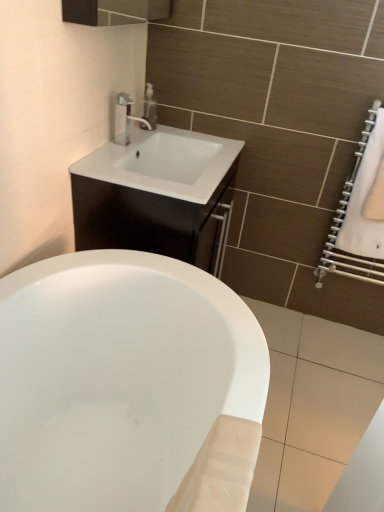
What are the coordinates of `matte silver soap dispenser at upper center` in the screenshot? It's located at (149, 109).

This screenshot has width=384, height=512. Describe the element at coordinates (149, 109) in the screenshot. I see `matte silver soap dispenser at upper center` at that location.

In order to face white fabric towel at right, should I rotate leftwards or rightwards?

Turn right by 23.436 degrees to look at white fabric towel at right.

Locate an element on the screen. white glossy cabinet at upper center is located at coordinates (156, 192).

Does matte silver soap dispenser at upper center have a lesser width compared to white glossy cabinet at upper center?

Yes.

From a real-world perspective, is matte silver soap dispenser at upper center below white glossy cabinet at upper center?

No, from a real-world perspective, matte silver soap dispenser at upper center is not under white glossy cabinet at upper center.

Who is shorter, matte silver soap dispenser at upper center or white glossy cabinet at upper center?

With less height is matte silver soap dispenser at upper center.

From the image's perspective, between matte silver soap dispenser at upper center and white glossy cabinet at upper center, which one is located above?

From the image's view, matte silver soap dispenser at upper center is above.

Looking at this image, can you confirm if white glossy cabinet at upper center is bigger than satin nickel faucet at upper center?

Correct, white glossy cabinet at upper center is larger in size than satin nickel faucet at upper center.

Is white glossy cabinet at upper center spatially inside satin nickel faucet at upper center, or outside of it?

white glossy cabinet at upper center is not enclosed by satin nickel faucet at upper center.

Can you tell me how much white glossy cabinet at upper center and satin nickel faucet at upper center differ in facing direction?

They differ by 1.47 degrees in their facing directions.

Would you say white glossy cabinet at upper center is to the left or to the right of satin nickel faucet at upper center in the picture?

white glossy cabinet at upper center is positioned on satin nickel faucet at upper center's right side.

Which is less distant, (x=143, y=126) or (x=122, y=101)?

Point (x=143, y=126).

Can you tell me how much matte silver soap dispenser at upper center and satin nickel faucet at upper center differ in facing direction?

The angular difference between matte silver soap dispenser at upper center and satin nickel faucet at upper center is 0.00116 degrees.

Which object is closer to the camera taking this photo, matte silver soap dispenser at upper center or satin nickel faucet at upper center?

satin nickel faucet at upper center.

Between matte silver soap dispenser at upper center and satin nickel faucet at upper center, which one has less height?

Standing shorter between the two is matte silver soap dispenser at upper center.

Based on the photo, from the image's perspective, relative to matte silver soap dispenser at upper center, is white glossy cabinet at upper center above or below?

From the image's perspective, white glossy cabinet at upper center appears below matte silver soap dispenser at upper center.

Is white glossy cabinet at upper center not close to matte silver soap dispenser at upper center?

No, there isn't a large distance between white glossy cabinet at upper center and matte silver soap dispenser at upper center.

From the picture: Based on their positions, is white glossy cabinet at upper center located to the left or right of matte silver soap dispenser at upper center?

From the image, it's evident that white glossy cabinet at upper center is to the right of matte silver soap dispenser at upper center.

Is matte silver soap dispenser at upper center bigger than white fabric towel at right?

No.

Where is `bath towel lying on the right of matte silver soap dispenser at upper center`? bath towel lying on the right of matte silver soap dispenser at upper center is located at coordinates (364, 202).

From a real-world perspective, is matte silver soap dispenser at upper center physically located above or below white fabric towel at right?

In terms of real-world spatial position, matte silver soap dispenser at upper center is above white fabric towel at right.

Is matte silver soap dispenser at upper center wider or thinner than white fabric towel at right?

Considering their sizes, matte silver soap dispenser at upper center looks broader than white fabric towel at right.

Considering the sizes of white fabric towel at right and matte silver soap dispenser at upper center in the image, is white fabric towel at right taller or shorter than matte silver soap dispenser at upper center?

In the image, white fabric towel at right appears to be taller than matte silver soap dispenser at upper center.

From the image's perspective, relative to matte silver soap dispenser at upper center, is white fabric towel at right above or below?

white fabric towel at right is below matte silver soap dispenser at upper center.

Is white fabric towel at right completely or partially outside of matte silver soap dispenser at upper center?

white fabric towel at right lies outside matte silver soap dispenser at upper center's area.

Which is further, [211,241] or [378,231]?

The point [378,231] is farther.

From the image's perspective, is white glossy cabinet at upper center on top of white fabric towel at right?

Incorrect, from the image's perspective, white glossy cabinet at upper center is lower than white fabric towel at right.

Considering the sizes of white glossy cabinet at upper center and white fabric towel at right in the image, is white glossy cabinet at upper center bigger or smaller than white fabric towel at right?

white glossy cabinet at upper center is bigger than white fabric towel at right.

Locate an element on the screen. The height and width of the screenshot is (512, 384). bath towel that is behind the white glossy cabinet at upper center is located at coordinates (364, 202).

Identify the location of soap dispenser above the white glossy cabinet at upper center (from the image's perspective). Image resolution: width=384 pixels, height=512 pixels. (149, 109).

This screenshot has width=384, height=512. I want to click on bathroom cabinet located underneath the satin nickel faucet at upper center (from a real-world perspective), so (x=156, y=192).

Based on their spatial positions, is white fabric towel at right or white glossy cabinet at upper center further from matte silver soap dispenser at upper center?

white fabric towel at right.

Considering their positions, is matte silver soap dispenser at upper center positioned closer to white fabric towel at right than white glossy cabinet at upper center?

white glossy cabinet at upper center.

Based on their spatial positions, is white fabric towel at right or matte silver soap dispenser at upper center closer to satin nickel faucet at upper center?

matte silver soap dispenser at upper center lies closer to satin nickel faucet at upper center than the other object.

Consider the image. Looking at the image, which one is located closer to matte silver soap dispenser at upper center, satin nickel faucet at upper center or white glossy cabinet at upper center?

satin nickel faucet at upper center is positioned closer to the anchor matte silver soap dispenser at upper center.

Considering their positions, is white glossy cabinet at upper center positioned further to white fabric towel at right than satin nickel faucet at upper center?

The object further to white fabric towel at right is satin nickel faucet at upper center.

When comparing their distances from white glossy cabinet at upper center, does matte silver soap dispenser at upper center or satin nickel faucet at upper center seem further?

The object further to white glossy cabinet at upper center is matte silver soap dispenser at upper center.

Estimate the real-world distances between objects in this image. Which object is further from white glossy cabinet at upper center, satin nickel faucet at upper center or matte silver soap dispenser at upper center?

matte silver soap dispenser at upper center lies further to white glossy cabinet at upper center than the other object.

Looking at the image, which one is located further to satin nickel faucet at upper center, matte silver soap dispenser at upper center or white glossy cabinet at upper center?

white glossy cabinet at upper center is positioned further to the anchor satin nickel faucet at upper center.

This screenshot has height=512, width=384. In order to click on tap between matte silver soap dispenser at upper center and white glossy cabinet at upper center from top to bottom in this screenshot , I will do `click(131, 117)`.

Where is `soap dispenser situated between satin nickel faucet at upper center and white fabric towel at right from left to right`? The height and width of the screenshot is (512, 384). soap dispenser situated between satin nickel faucet at upper center and white fabric towel at right from left to right is located at coordinates (149, 109).

You are a GUI agent. You are given a task and a screenshot of the screen. Output one action in this format:
    pyautogui.click(x=<x>, y=<y>)
    Task: Click on the bathroom cabinet between matte silver soap dispenser at upper center and white fabric towel at right
    The image size is (384, 512).
    Given the screenshot: What is the action you would take?
    pyautogui.click(x=156, y=192)

You are a GUI agent. You are given a task and a screenshot of the screen. Output one action in this format:
    pyautogui.click(x=<x>, y=<y>)
    Task: Click on the bathroom cabinet between satin nickel faucet at upper center and white fabric towel at right from left to right
    The height and width of the screenshot is (512, 384).
    Given the screenshot: What is the action you would take?
    pyautogui.click(x=156, y=192)